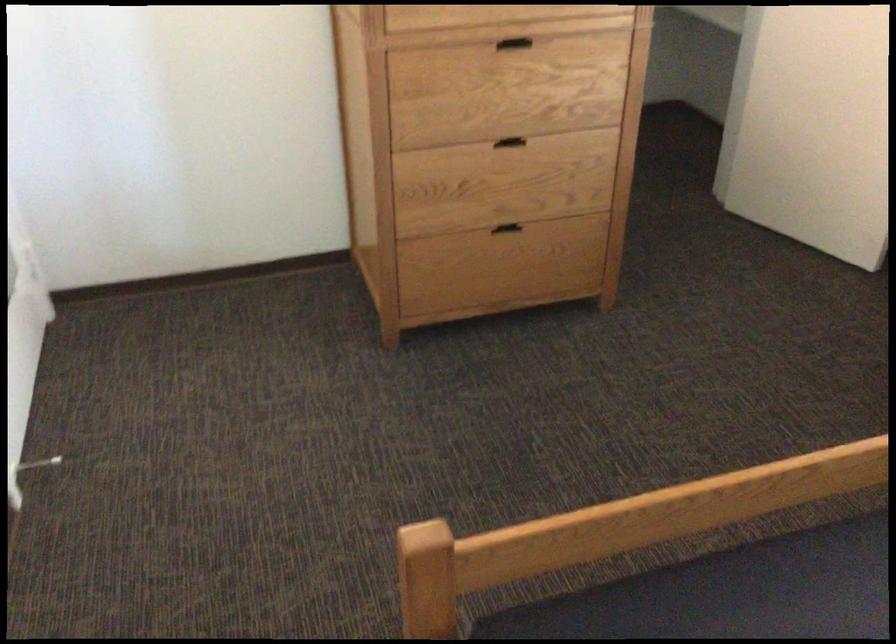
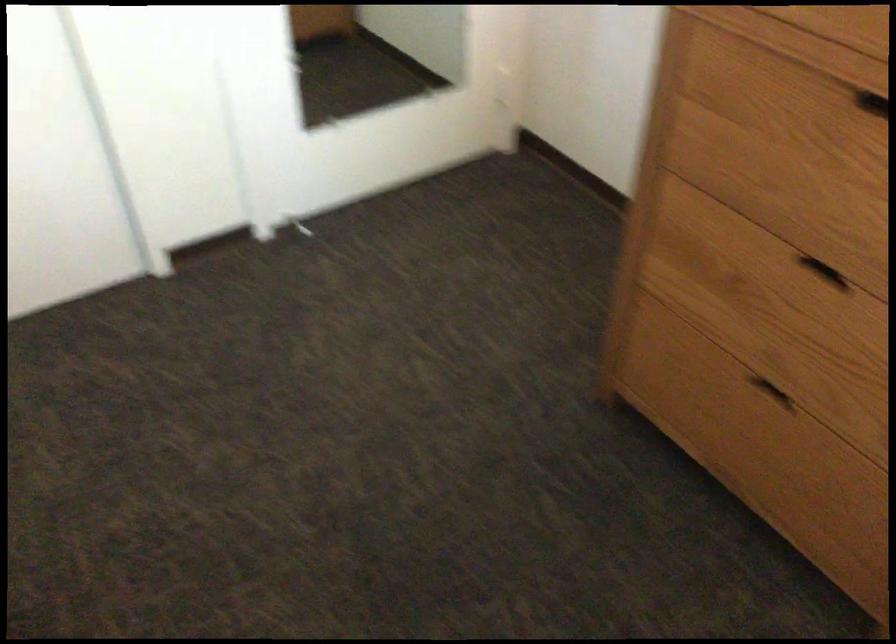
In the second image, find the point that corresponds to [497,142] in the first image.

(824, 272)